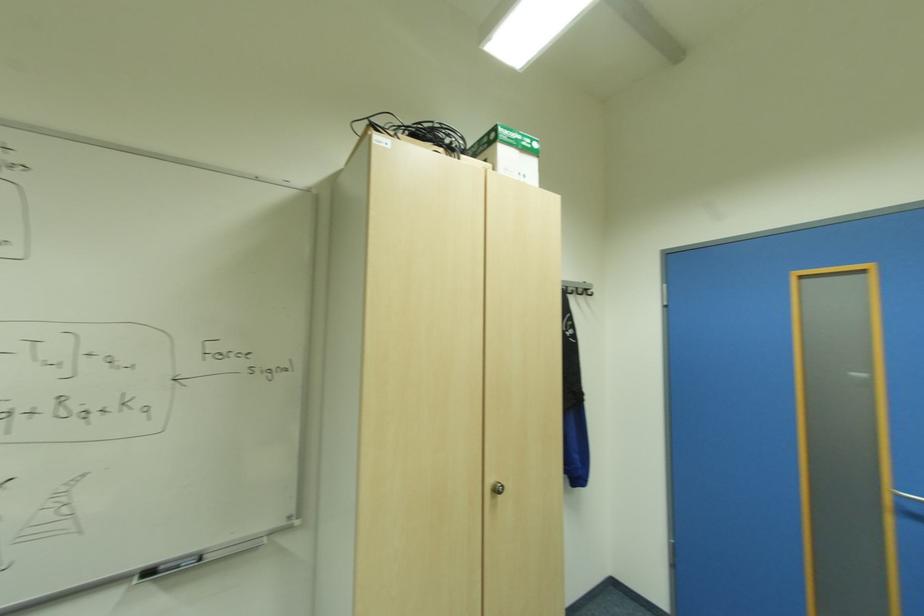
The width and height of the screenshot is (924, 616). What are the coordinates of `white paper box` in the screenshot? It's located at (508, 153).